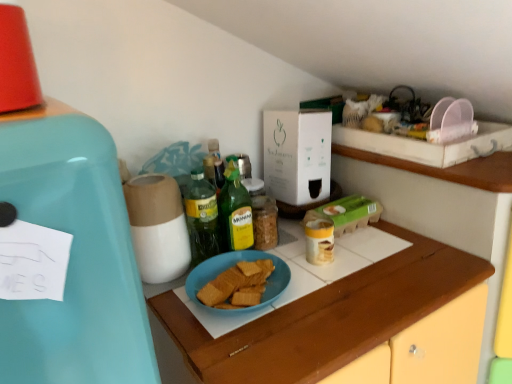
Locate an element on the screen. The image size is (512, 384). free spot above white cardboard box at center (from a real-world perspective) is located at coordinates (301, 108).